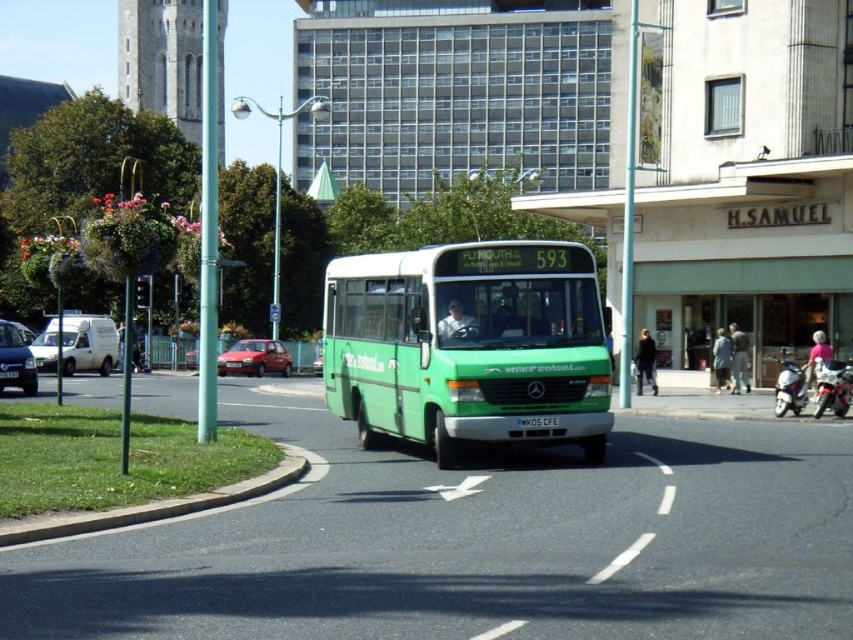
You are a pedestrian standing at the crosswalk. You see a metallic silver car at left and a white plastic license plate at center. If you want to cross the road safely, which object should you wait until it passes before proceeding?

You should wait until the metallic silver car at left passes before proceeding because it is closer to you than the white plastic license plate at center, which is farther away. The distance between them is 17.22 meters, indicating the car is nearer to the crosswalk.

You are a city planner reviewing the urban layout. The white plastic license plate at center is part of the green bus labeled Plymouth 593. How far apart are the modern highrise building and the historic tower in the background?

The modern highrise building and the historic tower are 52.10 feet apart.

You are a pedestrian standing at the crosswalk and see the metallic silver car at left and the white plastic license plate at center. Which one is positioned higher in the image?

The metallic silver car at left is positioned higher than the white plastic license plate at center in the image.